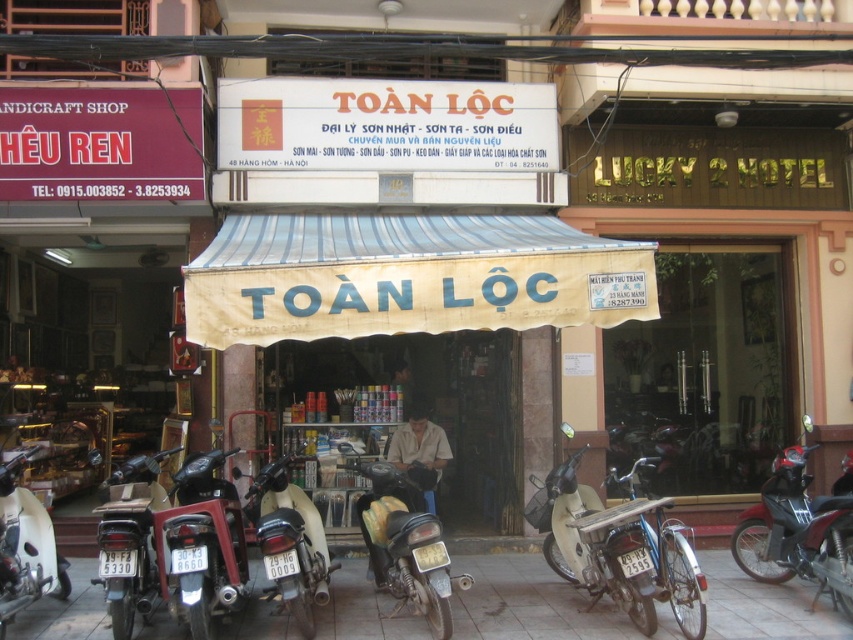
Is beige matte motorcycle at center wider than matte black motorcycle at center?

Yes, beige matte motorcycle at center is wider than matte black motorcycle at center.

Is beige matte motorcycle at center taller than matte black motorcycle at center?

No.

Which is in front, point (659, 595) or point (308, 572)?

Positioned in front is point (659, 595).

At what (x,y) coordinates should I click in order to perform the action: click on beige matte motorcycle at center. Please return your answer as a coordinate pair (x, y). Looking at the image, I should click on (616, 548).

Between beige matte motorcycle at center and metallic silver motorcycle at lower left, which one is positioned higher?

metallic silver motorcycle at lower left is above.

Does beige matte motorcycle at center appear over metallic silver motorcycle at lower left?

Incorrect, beige matte motorcycle at center is not positioned above metallic silver motorcycle at lower left.

Find the location of a particular element. This screenshot has height=640, width=853. beige matte motorcycle at center is located at coordinates (616, 548).

Is shiny red motorcycle at lower right to the left of matte black motorcycle at center from the viewer's perspective?

Incorrect, shiny red motorcycle at lower right is not on the left side of matte black motorcycle at center.

Where is `shiny red motorcycle at lower right`? The width and height of the screenshot is (853, 640). shiny red motorcycle at lower right is located at coordinates (798, 531).

I want to click on shiny red motorcycle at lower right, so click(x=798, y=531).